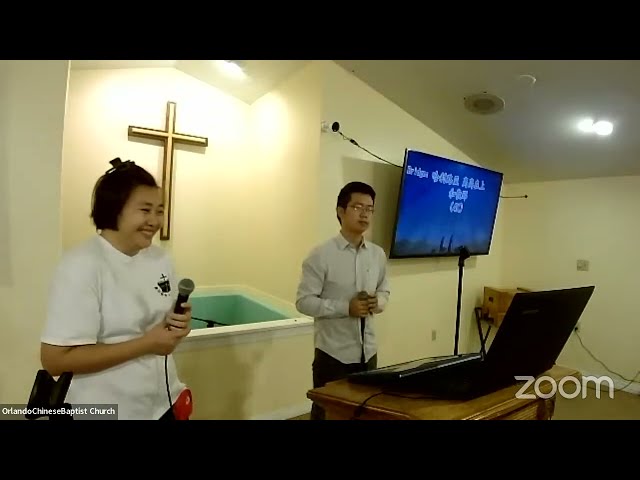
This screenshot has height=480, width=640. Find the location of `wall`. wall is located at coordinates (246, 181).